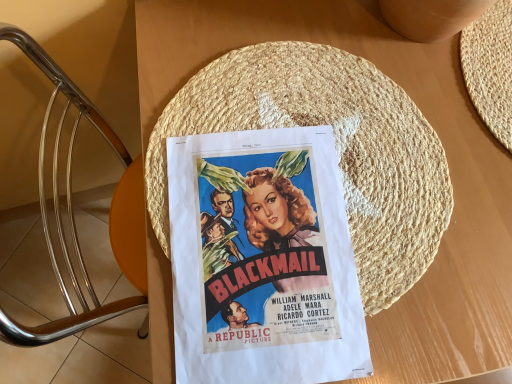
This screenshot has height=384, width=512. I want to click on vacant space to the right of matte paper poster at center, so click(x=430, y=249).